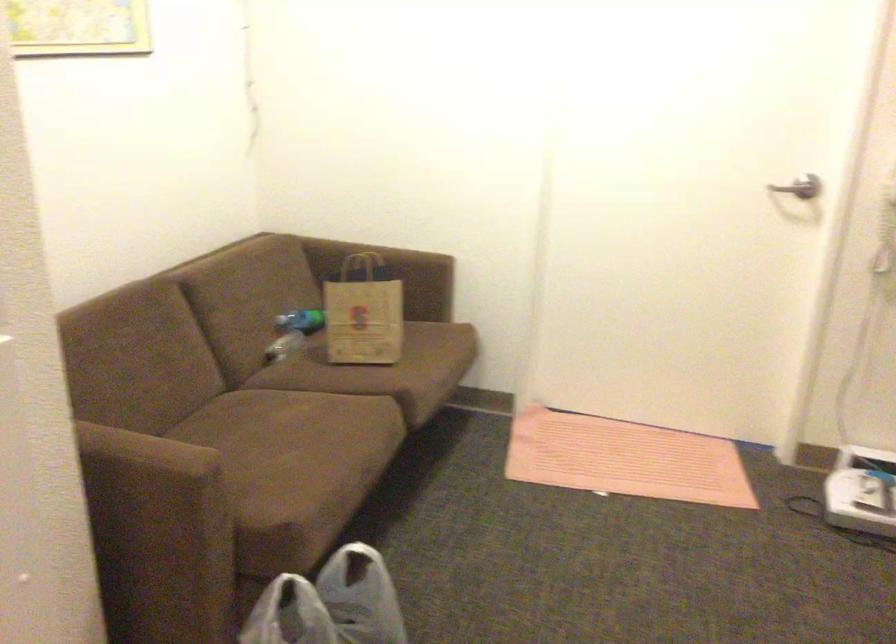
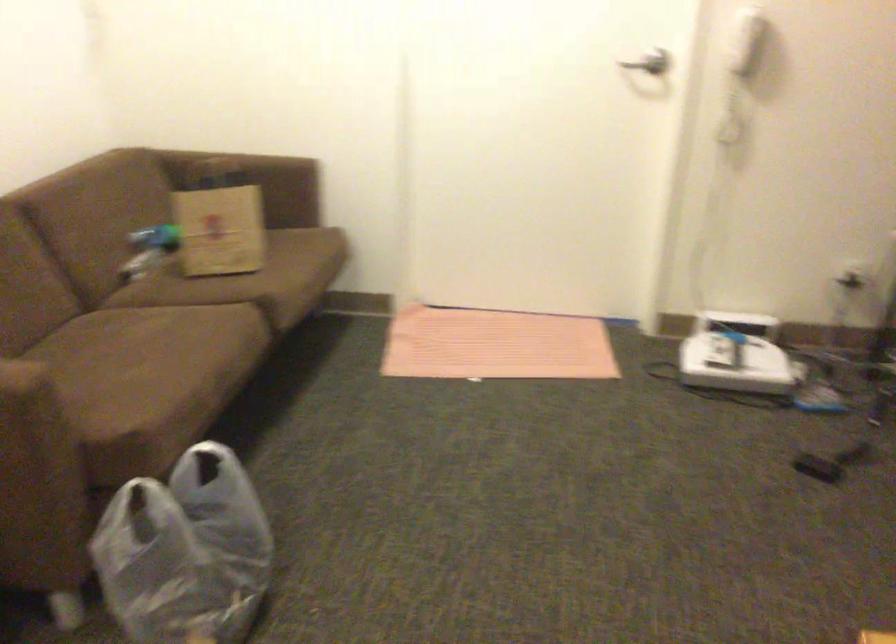
Find the pixel in the second image that matches the point at 259,494 in the first image.

(110, 402)